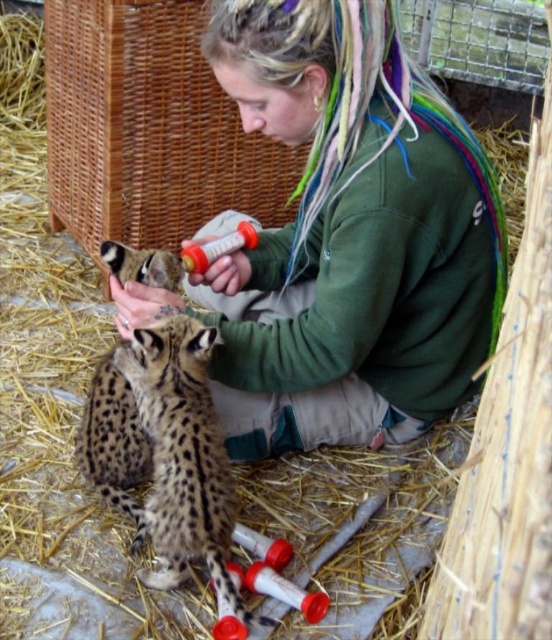
Does green fleece jacket at center have a larger size compared to spotted fur cheetah at center?

Correct, green fleece jacket at center is larger in size than spotted fur cheetah at center.

Is green fleece jacket at center taller than spotted fur cheetah at center?

Yes, green fleece jacket at center is taller than spotted fur cheetah at center.

Which is in front, point (339, 307) or point (194, 486)?

Point (339, 307) is in front.

Identify the location of green fleece jacket at center. (349, 236).